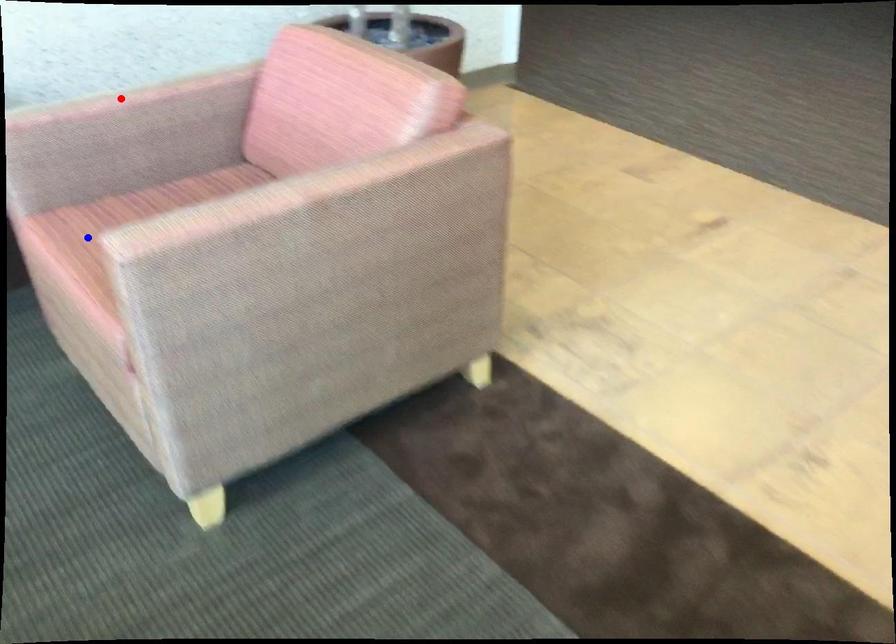
Question: In the image, two points are highlighted. Which point is nearer to the camera? Reply with the corresponding letter.

Choices:
 (A) blue point
 (B) red point

Answer: (A)